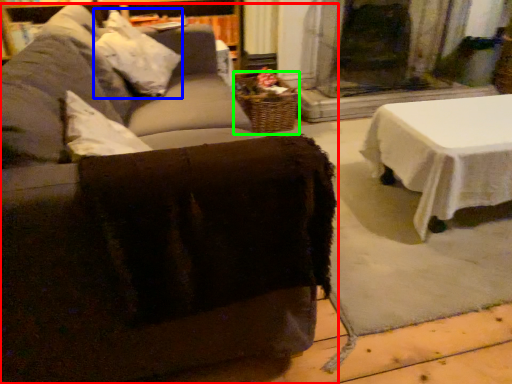
Question: Which object is positioned closest to studio couch (highlighted by a red box)? Select from pillow (highlighted by a blue box) and basket (highlighted by a green box).

Choices:
 (A) pillow
 (B) basket

Answer: (A)